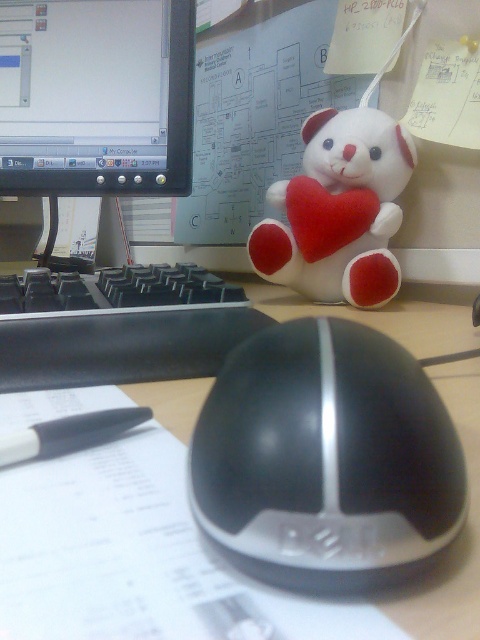
Question: Is black plastic keyboard at left positioned before black plastic pen at center?

Choices:
 (A) yes
 (B) no

Answer: (B)

Question: Where is black glossy mouse at center located in relation to matte plastic monitor at upper left in the image?

Choices:
 (A) below
 (B) above

Answer: (A)

Question: Estimate the real-world distances between objects in this image. Which object is closer to the black glossy mouse at center?

Choices:
 (A) black plastic mouse at center
 (B) black plastic pen at center
 (C) black plastic keyboard at left

Answer: (B)

Question: Considering the real-world distances, which object is closest to the white plush bear at upper center?

Choices:
 (A) black glossy mouse at center
 (B) black plastic keyboard at left
 (C) black plastic mouse at center
 (D) matte plastic monitor at upper left

Answer: (C)

Question: Does black plastic keyboard at left have a smaller size compared to black plastic pen at center?

Choices:
 (A) yes
 (B) no

Answer: (B)

Question: Which is nearer to the black plastic mouse at center?

Choices:
 (A) black plastic pen at center
 (B) matte plastic monitor at upper left

Answer: (A)